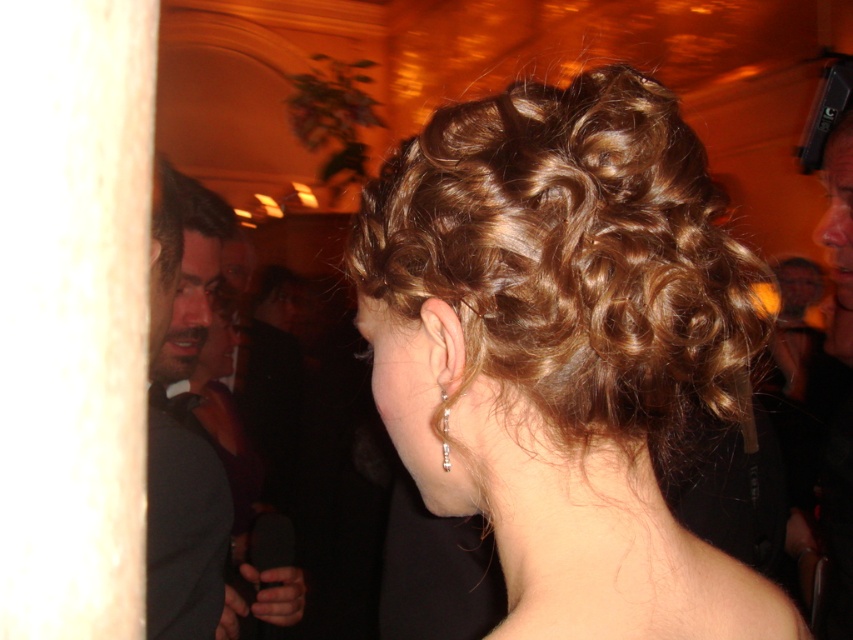
Question: Is shiny brown hair at center above shiny black suit at left?

Choices:
 (A) no
 (B) yes

Answer: (B)

Question: Does shiny brown hair at center come in front of shiny black suit at left?

Choices:
 (A) no
 (B) yes

Answer: (B)

Question: Which object appears closest to the camera in this image?

Choices:
 (A) shiny brown hair at center
 (B) shiny black suit at left

Answer: (A)

Question: Which point appears farthest from the camera in this image?

Choices:
 (A) (196, 314)
 (B) (468, 234)

Answer: (A)

Question: Can you confirm if shiny brown hair at center is positioned to the left of shiny black suit at left?

Choices:
 (A) no
 (B) yes

Answer: (A)